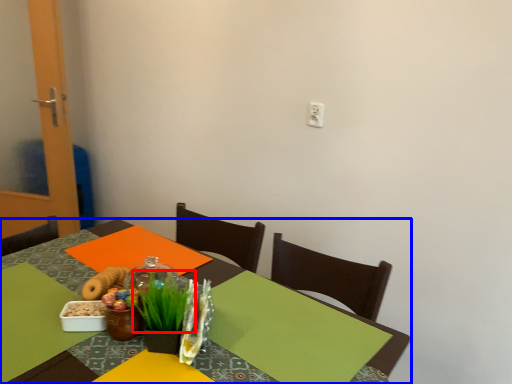
Question: Which object appears farthest to the camera in this image, grass (highlighted by a red box) or table (highlighted by a blue box)?

Choices:
 (A) grass
 (B) table

Answer: (A)